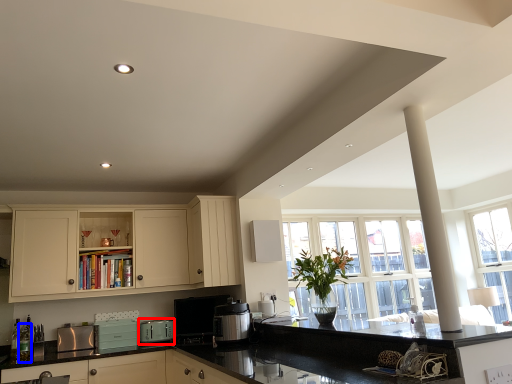
Question: Among these objects, which one is farthest to the camera, appliance (highlighted by a red box) or bottle (highlighted by a blue box)?

Choices:
 (A) appliance
 (B) bottle

Answer: (A)